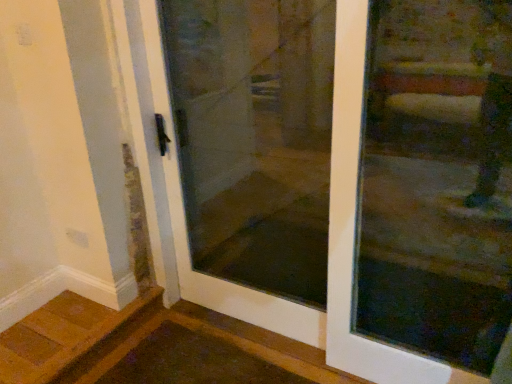
Question: Is transparent glass door at center oriented towards transparent glass door at center?

Choices:
 (A) no
 (B) yes

Answer: (A)

Question: Is transparent glass door at center in front of transparent glass door at center?

Choices:
 (A) no
 (B) yes

Answer: (B)

Question: From the image's perspective, is transparent glass door at center on top of transparent glass door at center?

Choices:
 (A) no
 (B) yes

Answer: (A)

Question: From the image's perspective, is transparent glass door at center beneath transparent glass door at center?

Choices:
 (A) no
 (B) yes

Answer: (B)

Question: Would you say transparent glass door at center is outside transparent glass door at center?

Choices:
 (A) yes
 (B) no

Answer: (A)

Question: Is the position of transparent glass door at center more distant than that of transparent glass door at center?

Choices:
 (A) no
 (B) yes

Answer: (A)

Question: From the image's perspective, is transparent glass door at center located beneath transparent glass door at center?

Choices:
 (A) no
 (B) yes

Answer: (A)

Question: From a real-world perspective, is transparent glass door at center under transparent glass door at center?

Choices:
 (A) no
 (B) yes

Answer: (A)

Question: Is transparent glass door at center at the right side of transparent glass door at center?

Choices:
 (A) yes
 (B) no

Answer: (B)

Question: Is the surface of transparent glass door at center in direct contact with transparent glass door at center?

Choices:
 (A) no
 (B) yes

Answer: (A)

Question: From a real-world perspective, is transparent glass door at center on top of transparent glass door at center?

Choices:
 (A) no
 (B) yes

Answer: (B)

Question: Is transparent glass door at center completely or partially outside of transparent glass door at center?

Choices:
 (A) no
 (B) yes

Answer: (B)

Question: Is transparent glass door at center taller or shorter than transparent glass door at center?

Choices:
 (A) short
 (B) tall

Answer: (B)